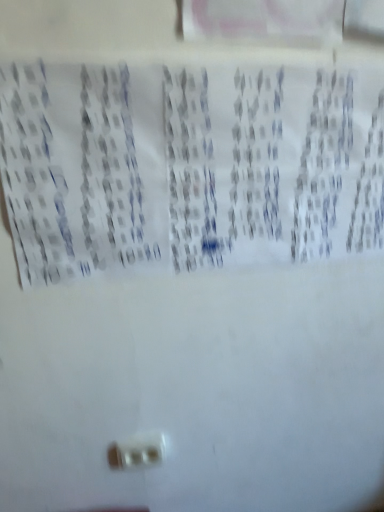
Question: Is white plastic power plugs and sockets at lower center situated inside white paper at center or outside?

Choices:
 (A) outside
 (B) inside

Answer: (A)

Question: From a real-world perspective, is white plastic power plugs and sockets at lower center physically located above or below white paper at center?

Choices:
 (A) below
 (B) above

Answer: (A)

Question: Is white plastic power plugs and sockets at lower center to the left or to the right of white paper at center in the image?

Choices:
 (A) left
 (B) right

Answer: (A)

Question: Looking at the image, does white paper at center seem bigger or smaller compared to white plastic power plugs and sockets at lower center?

Choices:
 (A) small
 (B) big

Answer: (B)

Question: Considering the relative positions of white paper at center and white plastic power plugs and sockets at lower center in the image provided, is white paper at center to the left or to the right of white plastic power plugs and sockets at lower center?

Choices:
 (A) right
 (B) left

Answer: (A)

Question: Is white paper at center inside or outside of white plastic power plugs and sockets at lower center?

Choices:
 (A) inside
 (B) outside

Answer: (B)

Question: From the image's perspective, relative to white plastic power plugs and sockets at lower center, is white paper at center above or below?

Choices:
 (A) above
 (B) below

Answer: (A)